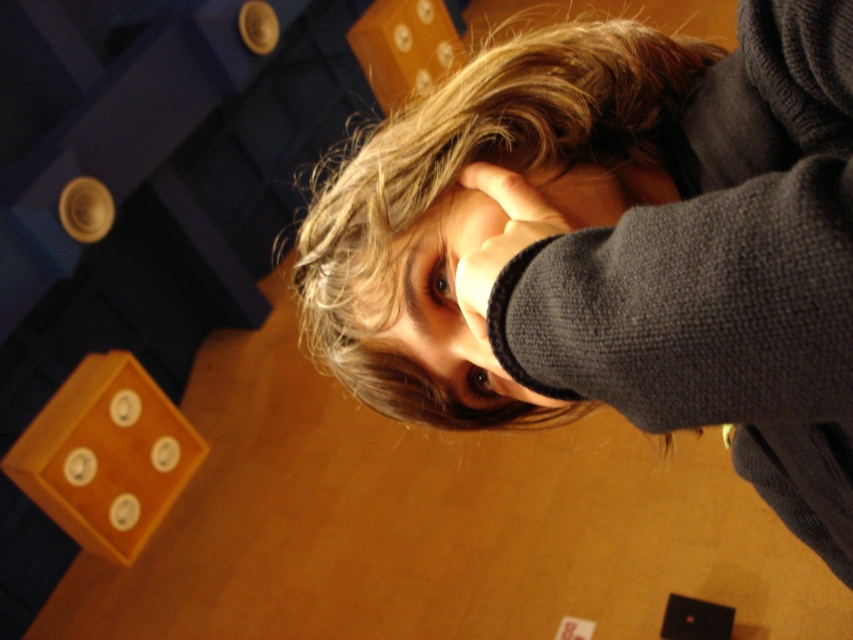
You are a photographer trying to capture a closeup of the person in the scene. The camera is positioned at the center of the image. The point representing the person is at point (x=477, y=208). To ensure the subject is centered in the frame, should you move the camera left or right? Explain your reasoning based on the coordinates provided.

The point representing the person is at coordinates (x=477, y=208). Since the camera is at the center of the image, which would be at coordinates 0.5, 0.5, the person is positioned to the left of the center. To center them, move the camera slightly to the left to align with the person.

You are taking a photo of the scene and want to focus on both the point at point (447, 337) and the point at point (512, 177). Which point is closer to the camera?

Point (512, 177) is closer to the camera than point (447, 337) because the description states that point (447, 337) is further away.